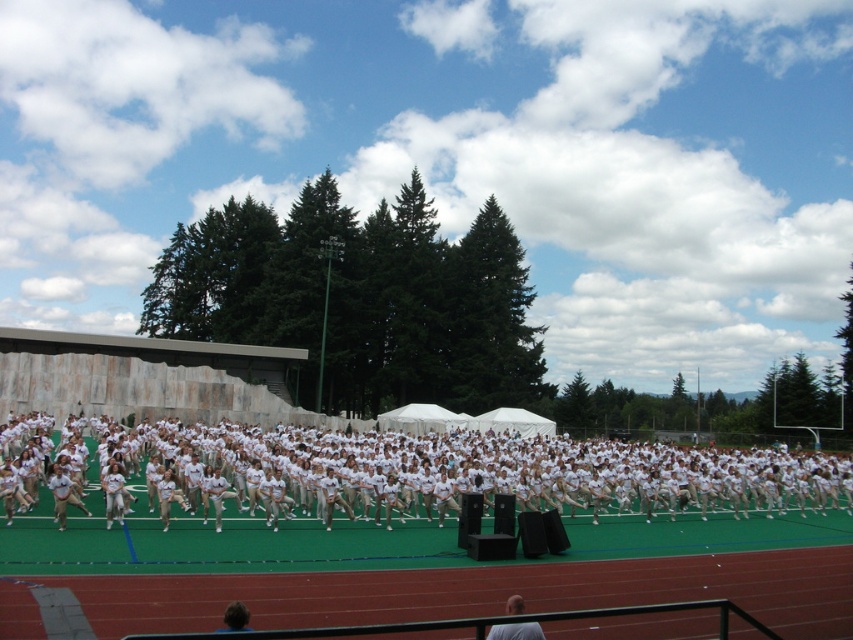
Question: Can you confirm if light brown uniform at center is smaller than white matte shirt at lower center?

Choices:
 (A) yes
 (B) no

Answer: (A)

Question: Is white matte shirt at lower center wider than dark brown hair at lower center?

Choices:
 (A) yes
 (B) no

Answer: (B)

Question: Among these objects, which one is nearest to the camera?

Choices:
 (A) white matte uniform at center
 (B) white matte shirt at lower center
 (C) dark brown hair at lower center
 (D) light brown uniform at center

Answer: (C)

Question: Which point is farther from the camera taking this photo?

Choices:
 (A) (234, 620)
 (B) (799, 497)

Answer: (B)

Question: Which object is positioned farthest from the white matte shirt at lower center?

Choices:
 (A) white matte uniform at center
 (B) light brown uniform at center
 (C) dark brown hair at lower center

Answer: (A)

Question: Observing the image, what is the correct spatial positioning of white matte shirt at lower center in reference to dark brown hair at lower center?

Choices:
 (A) right
 (B) left

Answer: (A)